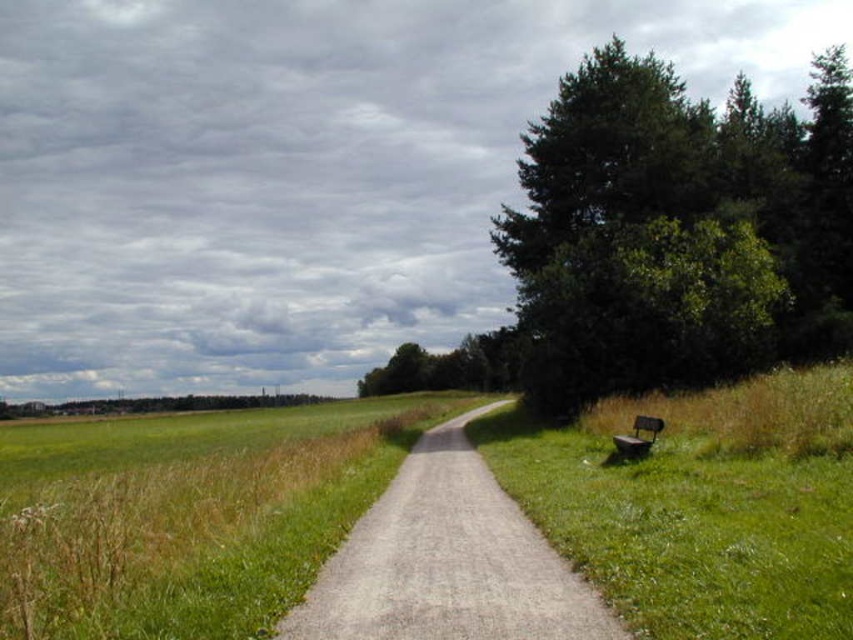
Is dark green leafy tree at upper right in front of gray gravel path at center?

No, it is not.

Is dark green leafy tree at upper right further to the viewer compared to gray gravel path at center?

Yes, dark green leafy tree at upper right is behind gray gravel path at center.

Which is in front, point (708, 248) or point (422, 637)?

Point (422, 637) is more forward.

Identify the location of dark green leafy tree at upper right. The image size is (853, 640). (662, 241).

Can you confirm if dark green leafy tree at upper right is positioned below wooden park bench at right?

No.

Does point (590, 145) come farther from viewer compared to point (659, 429)?

Yes.

The image size is (853, 640). Find the location of `dark green leafy tree at upper right`. dark green leafy tree at upper right is located at coordinates (662, 241).

Locate an element on the screen. The width and height of the screenshot is (853, 640). dark green leafy tree at upper right is located at coordinates (662, 241).

Is point (451, 484) behind point (653, 417)?

That is False.

Does gray gravel path at center have a smaller size compared to wooden park bench at right?

Incorrect, gray gravel path at center is not smaller in size than wooden park bench at right.

You are a GUI agent. You are given a task and a screenshot of the screen. Output one action in this format:
    pyautogui.click(x=<x>, y=<y>)
    Task: Click on the gray gravel path at center
    Image resolution: width=853 pixels, height=640 pixels.
    Given the screenshot: What is the action you would take?
    pyautogui.click(x=447, y=561)